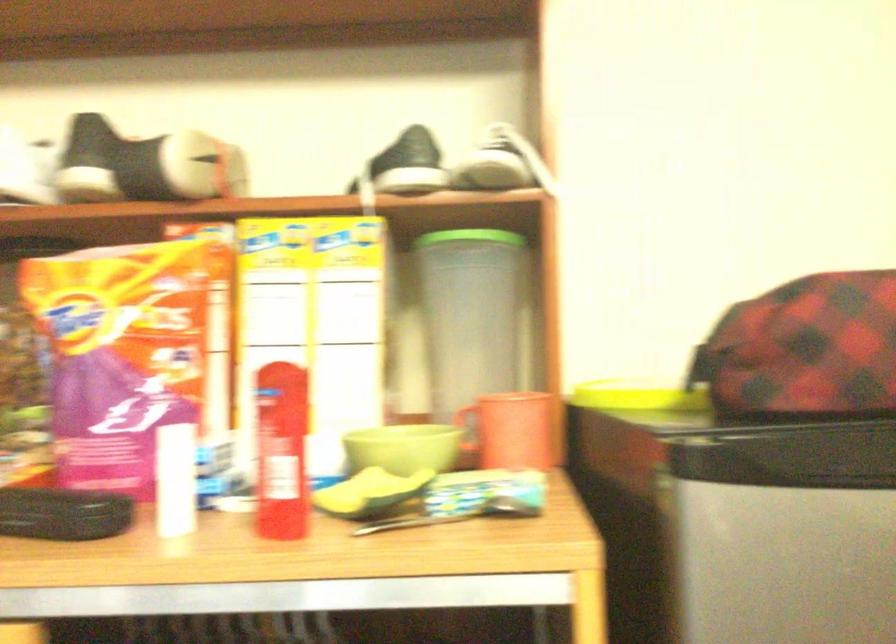
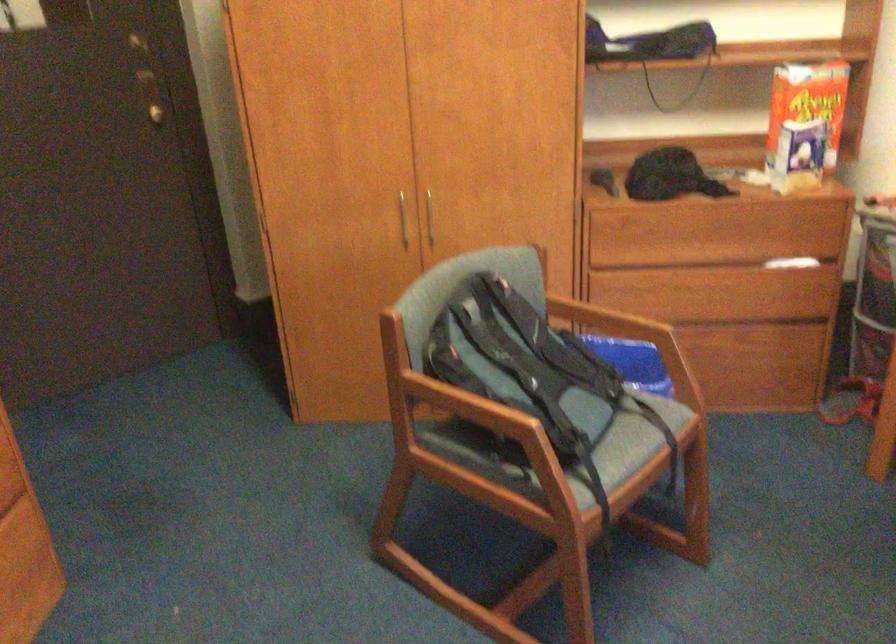
Looking at this image, the images are taken continuously from a first-person perspective. In which direction is your viewpoint rotating?

The camera's rotation is toward right-down.